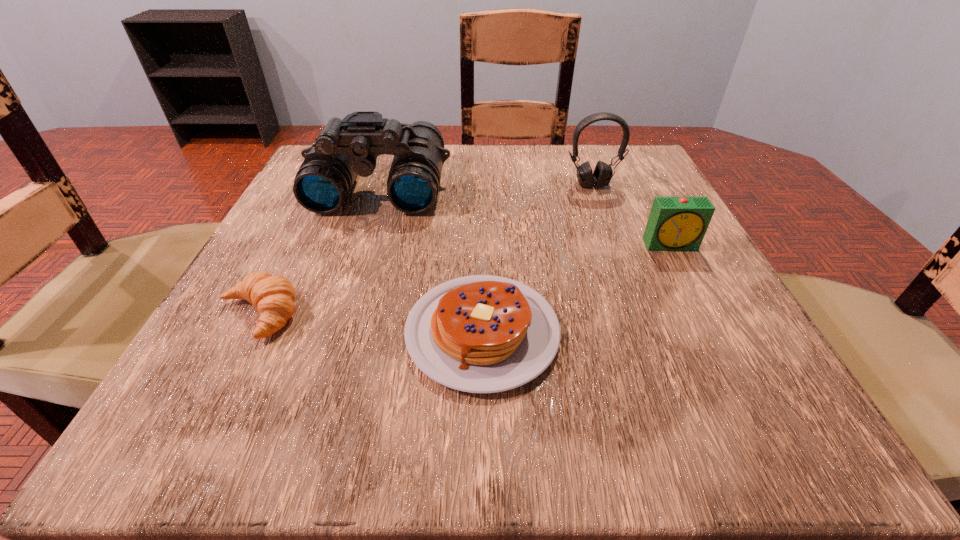
In order to click on binoculars in this screenshot , I will do `click(347, 147)`.

Find the location of a particular element. This screenshot has width=960, height=540. headset is located at coordinates pyautogui.click(x=602, y=174).

Where is `the third tallest object`? Image resolution: width=960 pixels, height=540 pixels. the third tallest object is located at coordinates (675, 223).

Where is `the third nearest object`? This screenshot has height=540, width=960. the third nearest object is located at coordinates (675, 223).

This screenshot has width=960, height=540. Identify the location of crescent roll. [x=274, y=296].

Identify the location of pancake. (480, 334).

I want to click on free space located 0.310m through the lenses of the binoculars, so click(x=324, y=354).

Locate an element on the screen. The image size is (960, 540). free location located 0.170m on the front-facing side of the headset is located at coordinates (614, 244).

Image resolution: width=960 pixels, height=540 pixels. What are the coordinates of `vacant space located on the front-facing side of the third tallest object` in the screenshot? It's located at (705, 309).

Locate an element on the screen. The width and height of the screenshot is (960, 540). free space located on the back of the crescent roll is located at coordinates (333, 167).